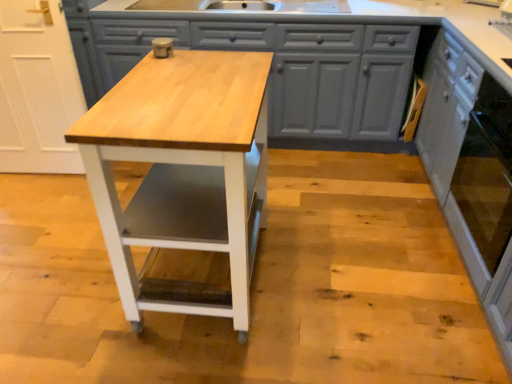
Question: In the image, is white painted wood cabinet at right, marked as the second cabinetry in a left-to-right arrangement, positioned in front of or behind matte gray cabinets at center, which is the second cabinetry from right to left?

Choices:
 (A) behind
 (B) front

Answer: (B)

Question: Considering the positions of white painted wood cabinet at right, marked as the second cabinetry in a left-to-right arrangement, and matte gray cabinets at center, placed as the first cabinetry when sorted from left to right, in the image, is white painted wood cabinet at right, marked as the second cabinetry in a left-to-right arrangement, wider or thinner than matte gray cabinets at center, placed as the first cabinetry when sorted from left to right,?

Choices:
 (A) thin
 (B) wide

Answer: (A)

Question: Which of these objects is positioned closest to the matte gray cabinets at center, which is the second cabinetry from right to left?

Choices:
 (A) white painted wood cabinet at right, marked as the second cabinetry in a left-to-right arrangement
 (B) natural wood table at center

Answer: (A)

Question: Which object is positioned farthest from the matte gray cabinets at center, which is the second cabinetry from right to left?

Choices:
 (A) white painted wood cabinet at right, arranged as the 1th cabinetry when viewed from the right
 (B) natural wood table at center

Answer: (B)